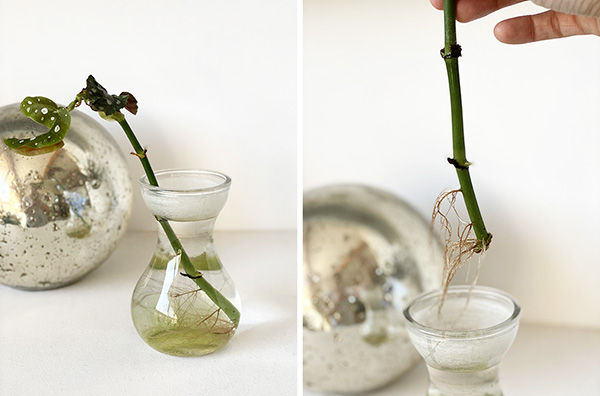
You are a GUI agent. You are given a task and a screenshot of the screen. Output one action in this format:
    pyautogui.click(x=<x>, y=<y>)
    Task: Click on the white wall
    
    Given the screenshot: What is the action you would take?
    pyautogui.click(x=206, y=51), pyautogui.click(x=348, y=58)